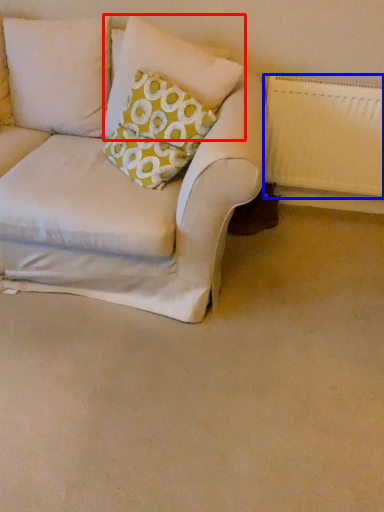
Question: Which of the following is the farthest to the observer, pillow (highlighted by a red box) or radiator (highlighted by a blue box)?

Choices:
 (A) pillow
 (B) radiator

Answer: (B)